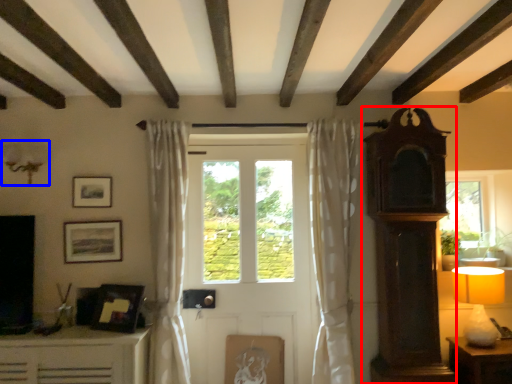
Question: Among these objects, which one is nearest to the camera, antique (highlighted by a red box) or lamp (highlighted by a blue box)?

Choices:
 (A) antique
 (B) lamp

Answer: (A)